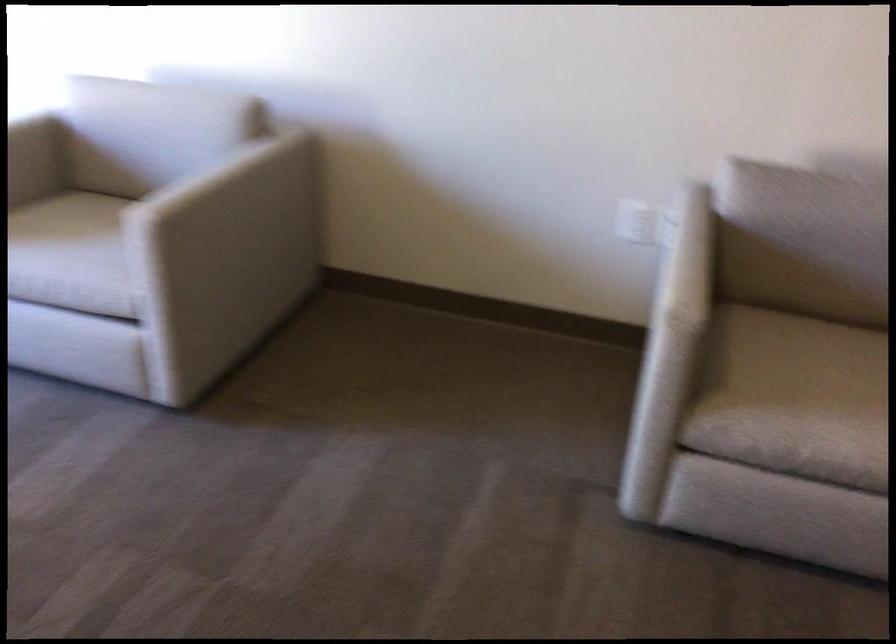
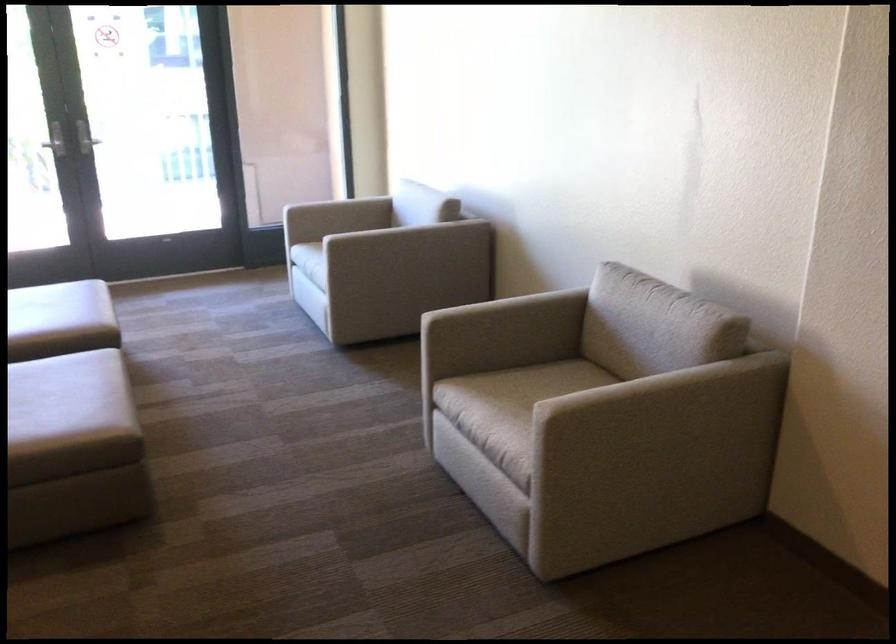
Question: I am providing you with two images of the same scene from different viewpoints. Which of the following objects are not visible in image2?

Choices:
 (A) beige ottoman
 (B) metal door handle
 (C) chair sitting surface
 (D) keyed switch

Answer: (C)